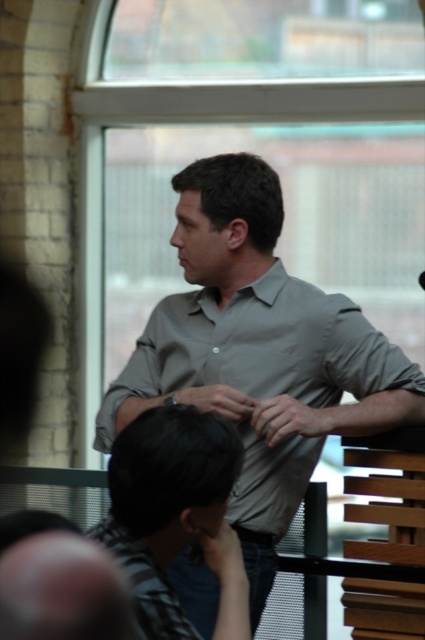
Question: Is gray matte shirt at center thinner than matte gray hand at center?

Choices:
 (A) no
 (B) yes

Answer: (A)

Question: Where is matte gray hand at center located in relation to matte black hand at lower center in the image?

Choices:
 (A) left
 (B) right

Answer: (B)

Question: Among these objects, which one is nearest to the camera?

Choices:
 (A) matte black hand at lower center
 (B) matte gray wristwatch at center

Answer: (A)

Question: Which point is farther from the camera taking this photo?

Choices:
 (A) (331, 428)
 (B) (212, 400)
 (C) (231, 582)
 (D) (255, 269)

Answer: (D)

Question: Which point is closer to the camera taking this photo?

Choices:
 (A) (215, 394)
 (B) (221, 492)
 (C) (299, 404)

Answer: (B)

Question: Does matte gray hand at center appear on the left side of matte black hand at lower center?

Choices:
 (A) no
 (B) yes

Answer: (A)